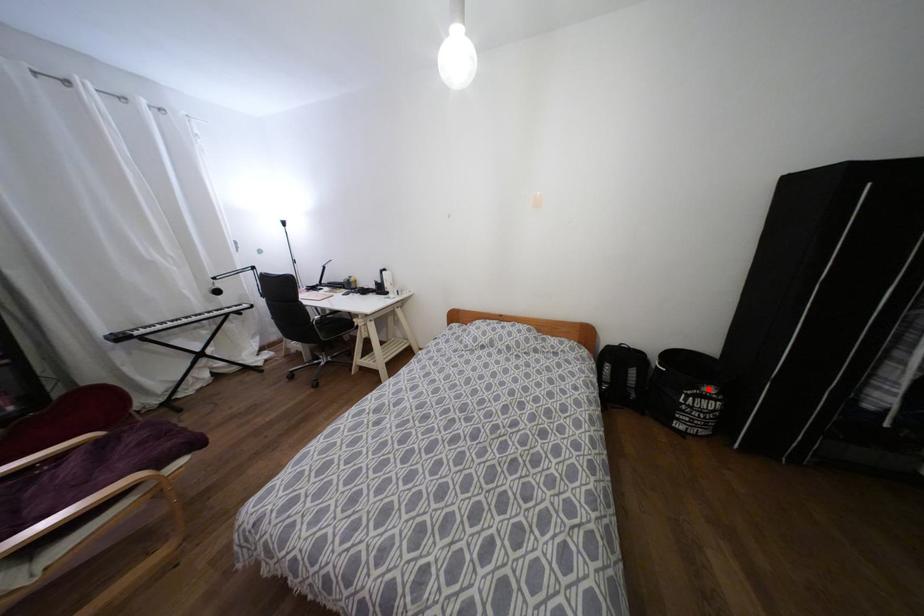
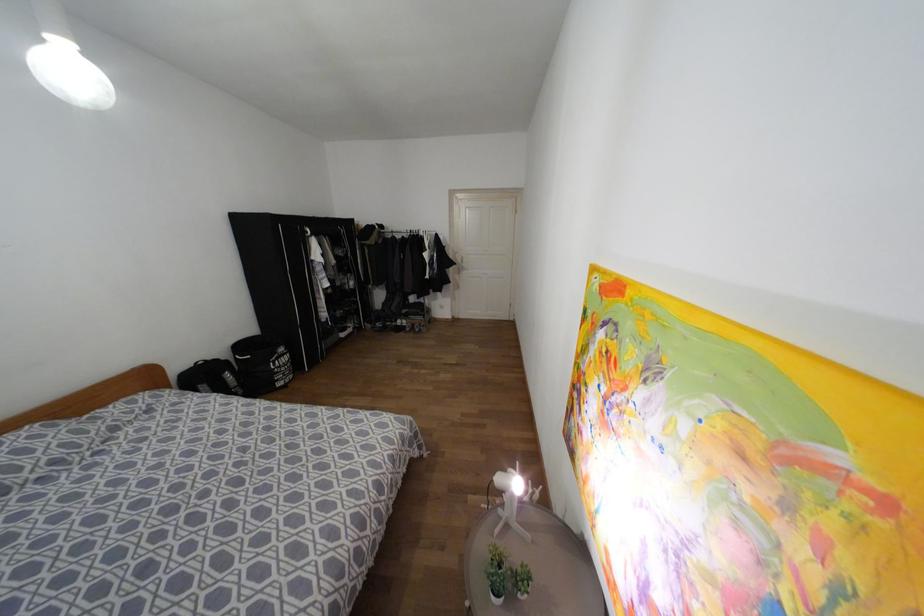
Question: I am providing you with two images of the same scene from different viewpoints. Image1 has a red point marked. In image2, the corresponding 3D location appears at what relative position? Reply with the corresponding letter.

Choices:
 (A) Closer
 (B) Farther

Answer: (A)